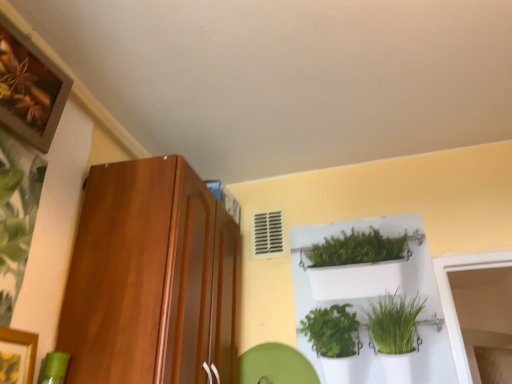
Question: From a real-world perspective, is shiny brown cabinet at left on wooden framed artwork at upper left?

Choices:
 (A) yes
 (B) no

Answer: (B)

Question: Considering the relative sizes of shiny brown cabinet at left and wooden framed artwork at upper left in the image provided, is shiny brown cabinet at left shorter than wooden framed artwork at upper left?

Choices:
 (A) yes
 (B) no

Answer: (B)

Question: Is shiny brown cabinet at left facing towards wooden framed artwork at upper left?

Choices:
 (A) yes
 (B) no

Answer: (B)

Question: Considering the relative sizes of shiny brown cabinet at left and wooden framed artwork at upper left in the image provided, is shiny brown cabinet at left smaller than wooden framed artwork at upper left?

Choices:
 (A) no
 (B) yes

Answer: (A)

Question: Is shiny brown cabinet at left with wooden framed artwork at upper left?

Choices:
 (A) yes
 (B) no

Answer: (B)

Question: Considering the relative positions of shiny brown cabinet at left and wooden framed artwork at upper left in the image provided, is shiny brown cabinet at left to the left of wooden framed artwork at upper left from the viewer's perspective?

Choices:
 (A) yes
 (B) no

Answer: (B)

Question: Considering the relative positions of white plastic shelf at upper center and green leafy plant at left in the image provided, is white plastic shelf at upper center behind green leafy plant at left?

Choices:
 (A) no
 (B) yes

Answer: (B)

Question: Does white plastic shelf at upper center have a greater width compared to green leafy plant at left?

Choices:
 (A) yes
 (B) no

Answer: (B)

Question: Considering the relative sizes of white plastic shelf at upper center and green leafy plant at left in the image provided, is white plastic shelf at upper center shorter than green leafy plant at left?

Choices:
 (A) yes
 (B) no

Answer: (B)

Question: Does white plastic shelf at upper center turn towards green leafy plant at left?

Choices:
 (A) no
 (B) yes

Answer: (A)

Question: From the image's perspective, does white plastic shelf at upper center appear lower than green leafy plant at left?

Choices:
 (A) no
 (B) yes

Answer: (B)

Question: Can you confirm if white plastic shelf at upper center is thinner than green leafy plant at left?

Choices:
 (A) no
 (B) yes

Answer: (B)

Question: Can you confirm if shiny brown cabinet at left is shorter than green leafy plant at left?

Choices:
 (A) no
 (B) yes

Answer: (A)